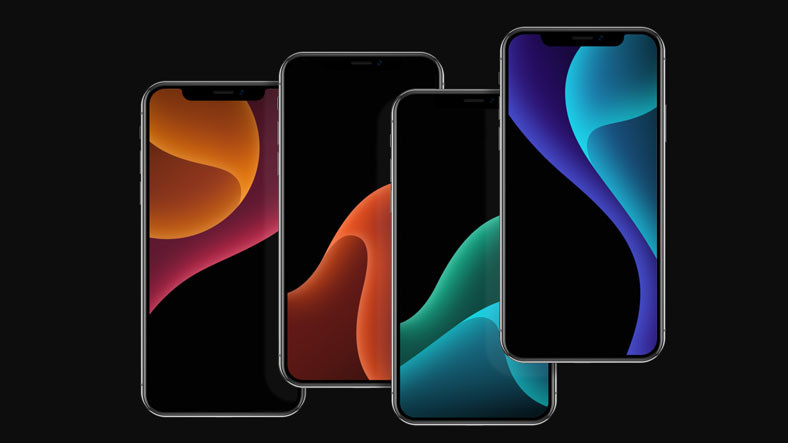
At what (x,y) coordinates should I click in order to perform the action: click on 1 phone on the right side. Please return your answer as a coordinate pair (x, y). This screenshot has height=443, width=788. Looking at the image, I should click on (563, 243).